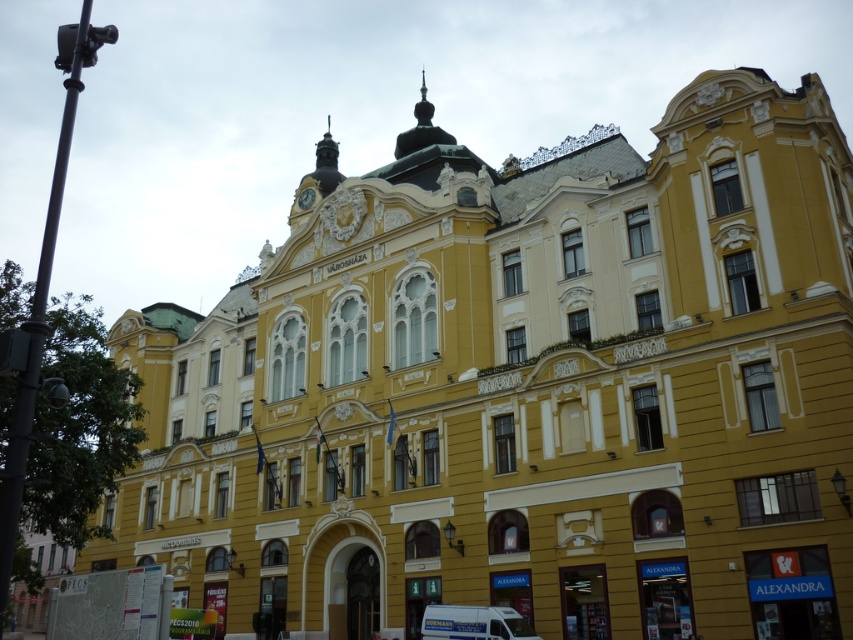
Question: Does white matte van at lower center lie behind gold metallic clock at upper center?

Choices:
 (A) yes
 (B) no

Answer: (B)

Question: Which object is closer to the camera taking this photo?

Choices:
 (A) gold metallic clock at upper center
 (B) white matte van at lower center

Answer: (B)

Question: Can you confirm if white matte van at lower center is positioned above gold metallic clock at upper center?

Choices:
 (A) no
 (B) yes

Answer: (A)

Question: Is white matte van at lower center bigger than gold metallic clock at upper center?

Choices:
 (A) yes
 (B) no

Answer: (B)

Question: Among these points, which one is farthest from the camera?

Choices:
 (A) (311, 205)
 (B) (490, 605)

Answer: (A)